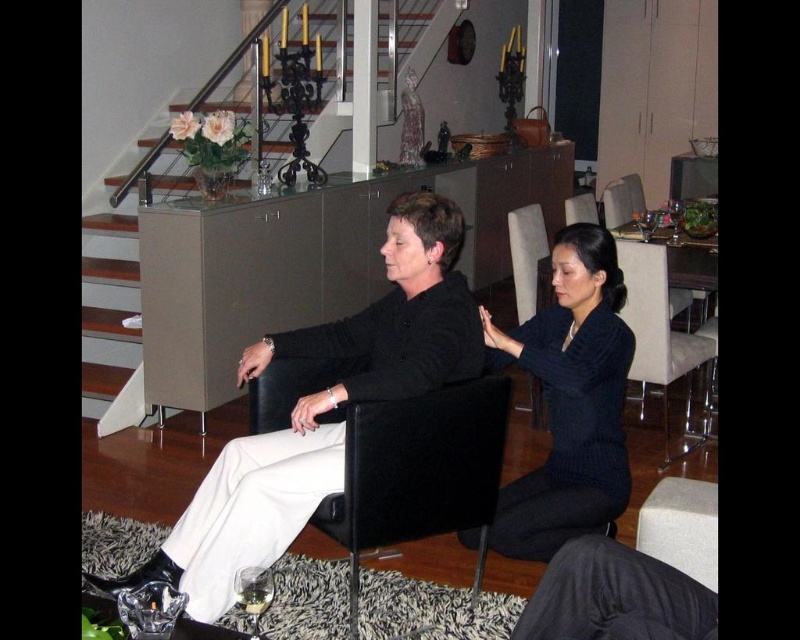
Can you confirm if white wooden stairs at center is positioned to the right of matte black chair at center?

Incorrect, white wooden stairs at center is not on the right side of matte black chair at center.

Which is in front, point (337, 310) or point (238, 449)?

Positioned in front is point (238, 449).

Is point (238, 326) farther from viewer compared to point (226, 547)?

Yes, it is behind point (226, 547).

This screenshot has height=640, width=800. In order to click on white wooden stairs at center in this screenshot , I will do `click(264, 257)`.

Is dark gray fabric pants at lower center above dark gray leather armchair at center?

Actually, dark gray fabric pants at lower center is below dark gray leather armchair at center.

Between dark gray fabric pants at lower center and dark gray leather armchair at center, which one appears on the right side from the viewer's perspective?

Positioned to the right is dark gray leather armchair at center.

Is point (690, 605) closer to viewer compared to point (525, 308)?

Yes.

Locate an element on the screen. dark gray fabric pants at lower center is located at coordinates (616, 596).

Is matte black chair at center to the left of dark gray leather armchair at center from the viewer's perspective?

Indeed, matte black chair at center is positioned on the left side of dark gray leather armchair at center.

This screenshot has width=800, height=640. Describe the element at coordinates (324, 410) in the screenshot. I see `matte black chair at center` at that location.

The image size is (800, 640). Identify the location of matte black chair at center. (324, 410).

What are the coordinates of `matte black chair at center` in the screenshot? It's located at (324, 410).